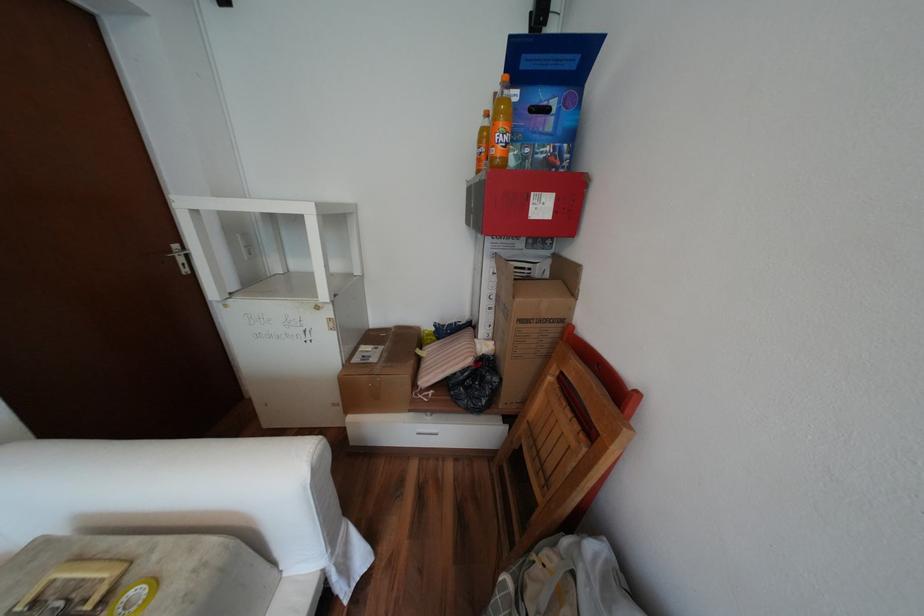
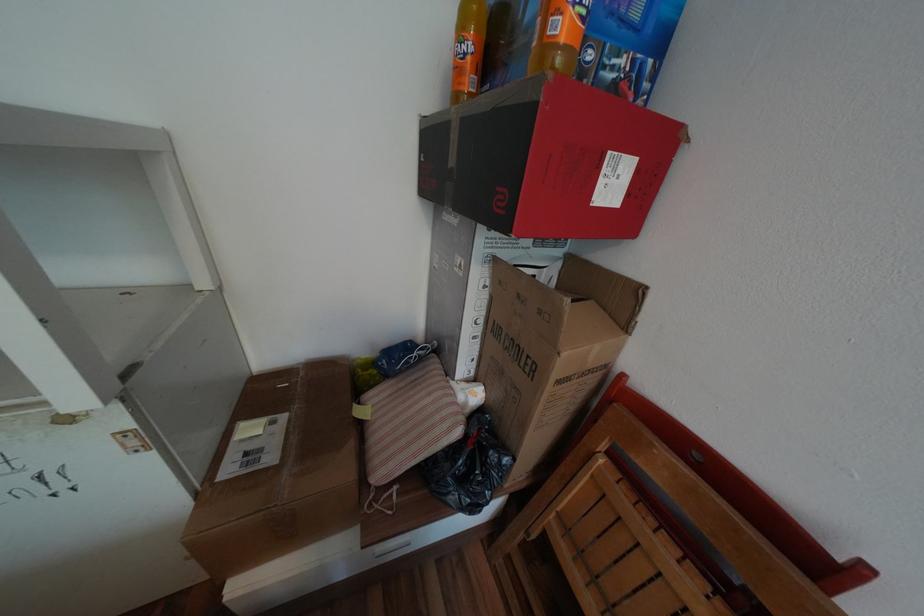
Find the pixel in the second image that matches (x=472, y=354) in the first image.

(453, 419)